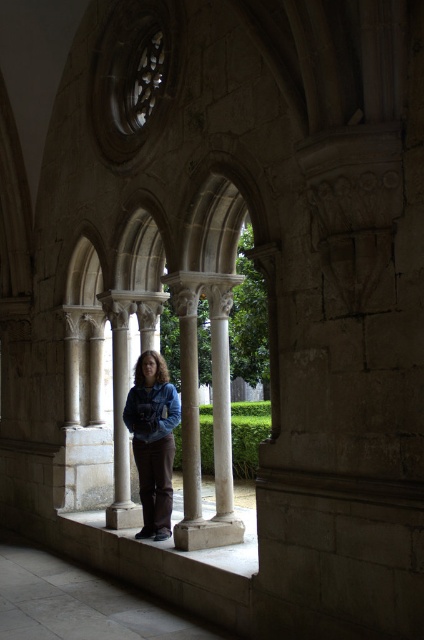
You are standing at the point closer to the camera in the image. Which point are you at, point (100,513) or point (136,433)?

You are at point (136,433) because it is closer to the camera than point (100,513), which is behind it.

Where is the blue denim jacket at center located in the image?

The blue denim jacket at center is located at point [153,440] in the image.

Based on the photo, you are a tour guide leading a group through the historic stone structure. You need to ensure that the safety distance between the blue denim jacket at center and the white stone ledge at center is maintained. What is the minimum distance you should keep between them to comply with preservation guidelines?

The blue denim jacket at center and white stone ledge at center are 2.46 meters apart from each other. To comply with preservation guidelines, the minimum distance should be at least 2.46 meters.